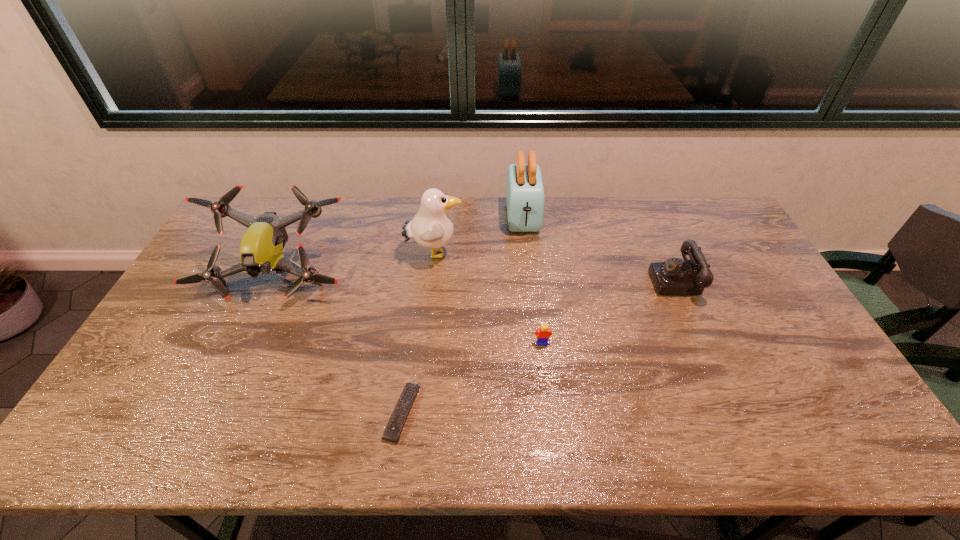
This screenshot has height=540, width=960. What are the coordinates of `blank region between the rightmost object and the toaster` in the screenshot? It's located at (599, 248).

Identify the location of free space between the farthest object and the Lego. (533, 280).

Where is `free area in between the gull and the second nearest object`? free area in between the gull and the second nearest object is located at coordinates (488, 298).

Find the location of a particular element. Image resolution: width=960 pixels, height=540 pixels. vacant region between the telephone and the gull is located at coordinates (555, 267).

Find the location of a particular element. vacant area between the leftmost object and the shortest object is located at coordinates (340, 344).

Locate an element on the screen. empty space between the Lego and the gull is located at coordinates (488, 298).

I want to click on object that is the third closest to the leftmost object, so click(525, 197).

Select which object appears as the third closest to the remote control. Please provide its 2D coordinates. Your answer should be formatted as a tuple, i.e. [(x, y)], where the tuple contains the x and y coordinates of a point satisfying the conditions above.

[(432, 227)]

The image size is (960, 540). What are the coordinates of `free spot that satisfies the following two spatial constraints: 1. on the dial of the third shortest object; 2. on the front side of the nearest object` in the screenshot? It's located at (734, 412).

Image resolution: width=960 pixels, height=540 pixels. What are the coordinates of `free space that satisfies the following two spatial constraints: 1. on the front-facing side of the shortest object; 2. on the right side of the leftmost object` in the screenshot? It's located at (215, 412).